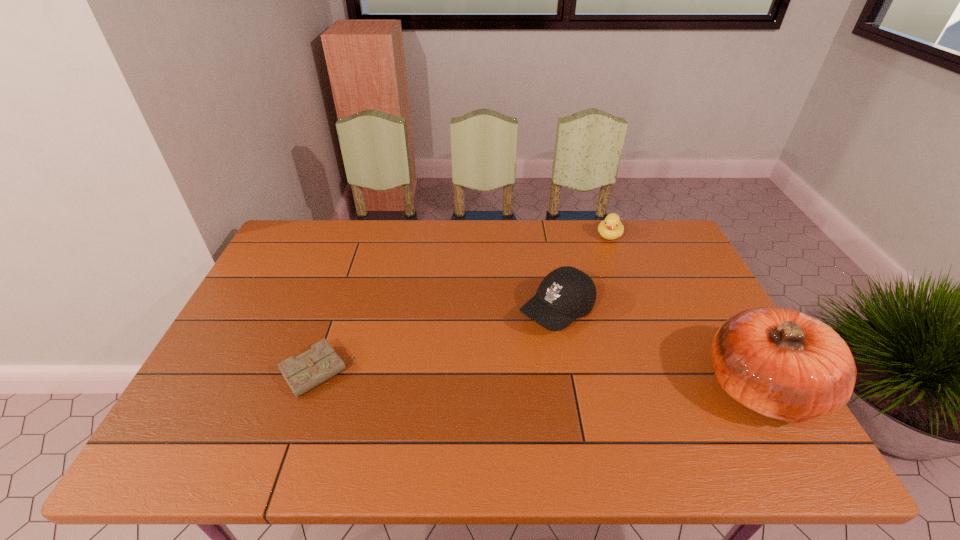
Identify the location of unoccupied position between the pumpkin and the duckling. (684, 311).

Locate an element on the screen. unoccupied area between the tallest object and the second tallest object is located at coordinates (659, 349).

The height and width of the screenshot is (540, 960). What are the coordinates of `vacant region between the diary and the third shortest object` in the screenshot? It's located at (437, 342).

The image size is (960, 540). Identify the location of free space between the rightmost object and the farthest object. click(684, 311).

Where is `free space that is in between the leftmost object and the second object from left to right`? free space that is in between the leftmost object and the second object from left to right is located at coordinates (x=437, y=342).

Identify the location of vacant space in between the tallest object and the third object from right to left. (659, 349).

Find the location of `empty space between the tallest object and the second farthest object`. empty space between the tallest object and the second farthest object is located at coordinates (659, 349).

You are a GUI agent. You are given a task and a screenshot of the screen. Output one action in this format:
    pyautogui.click(x=<x>, y=<y>)
    Task: Click on the empty space between the rightmost object and the third shortest object
    The width and height of the screenshot is (960, 540).
    Given the screenshot: What is the action you would take?
    pyautogui.click(x=659, y=349)

I want to click on object that is the second closest to the leftmost object, so pyautogui.click(x=611, y=228).

What are the coordinates of `the second closest object to the farthest object` in the screenshot? It's located at (780, 363).